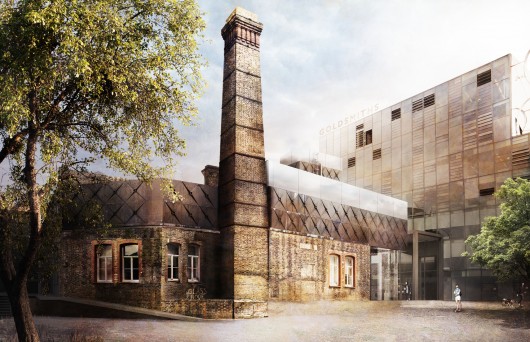
Find the location of a particular element. This screenshot has width=530, height=342. chimney is located at coordinates (248, 114).